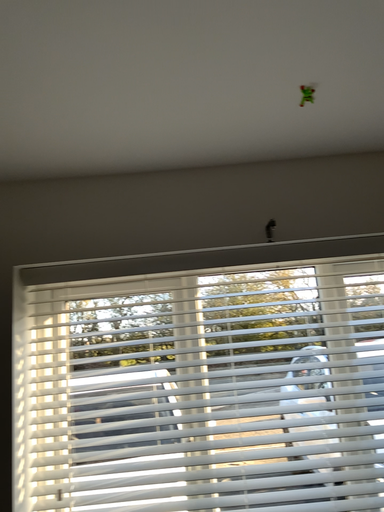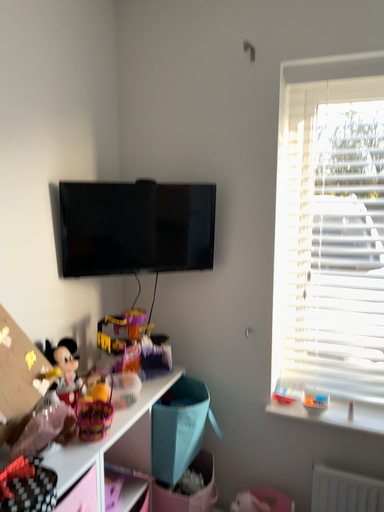
Question: Which way did the camera rotate in the video?

Choices:
 (A) rotated upward
 (B) rotated downward

Answer: (B)